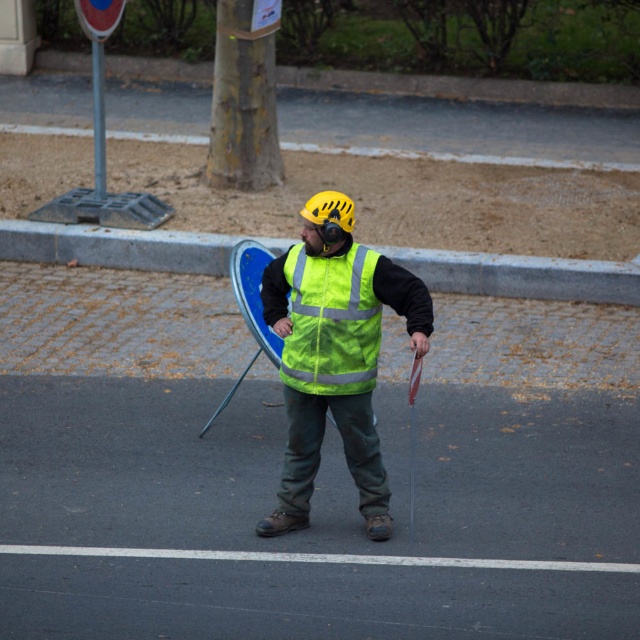
Question: Is high visibility fabric vest at center closer to camera compared to yellow matte helmet at center?

Choices:
 (A) no
 (B) yes

Answer: (B)

Question: Can you confirm if high-visibility fabric safety vest at center is positioned below yellow matte helmet at center?

Choices:
 (A) no
 (B) yes

Answer: (B)

Question: Which object is the closest to the high visibility fabric vest at center?

Choices:
 (A) high-visibility fabric safety vest at center
 (B) yellow matte helmet at center
 (C) metallic silver ski pole at center

Answer: (A)

Question: Which of the following is the farthest from the observer?

Choices:
 (A) high-visibility fabric safety vest at center
 (B) metallic silver ski pole at center
 (C) yellow matte helmet at center

Answer: (B)

Question: Which point is farther to the camera?

Choices:
 (A) metallic silver ski pole at center
 (B) yellow matte helmet at center

Answer: (A)

Question: Is yellow matte helmet at center closer to camera compared to metallic silver ski pole at center?

Choices:
 (A) yes
 (B) no

Answer: (A)